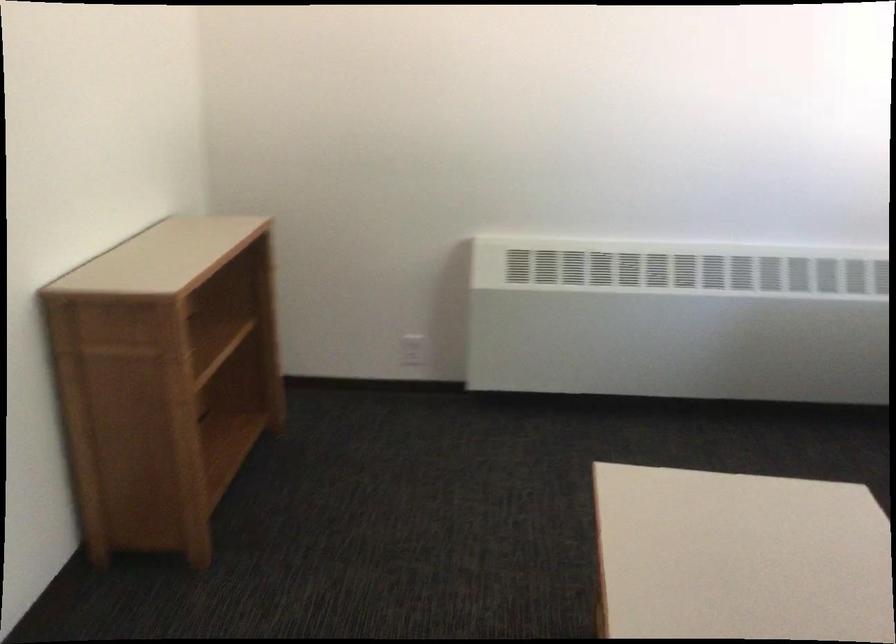
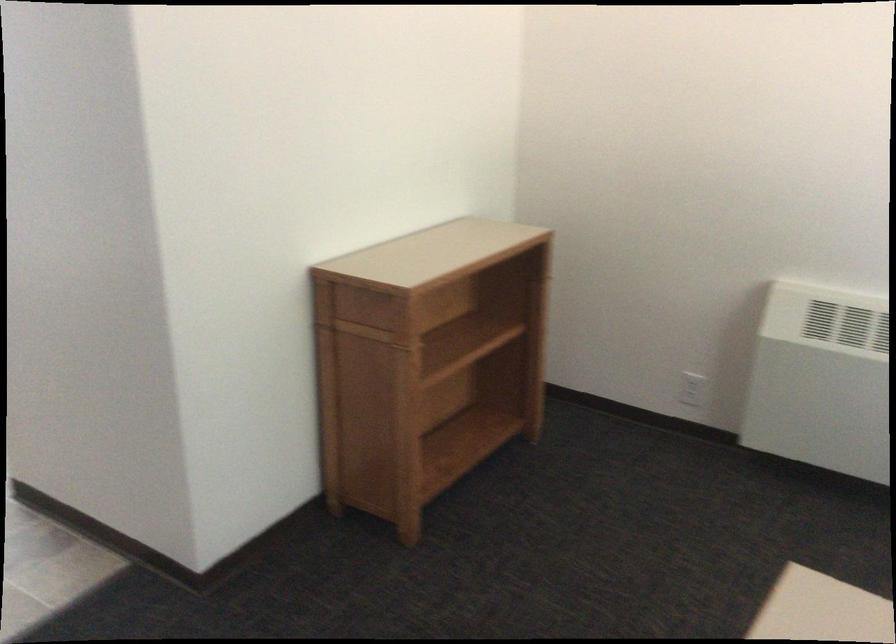
Where in the second image is the point corresponding to (x=211, y=351) from the first image?

(462, 345)